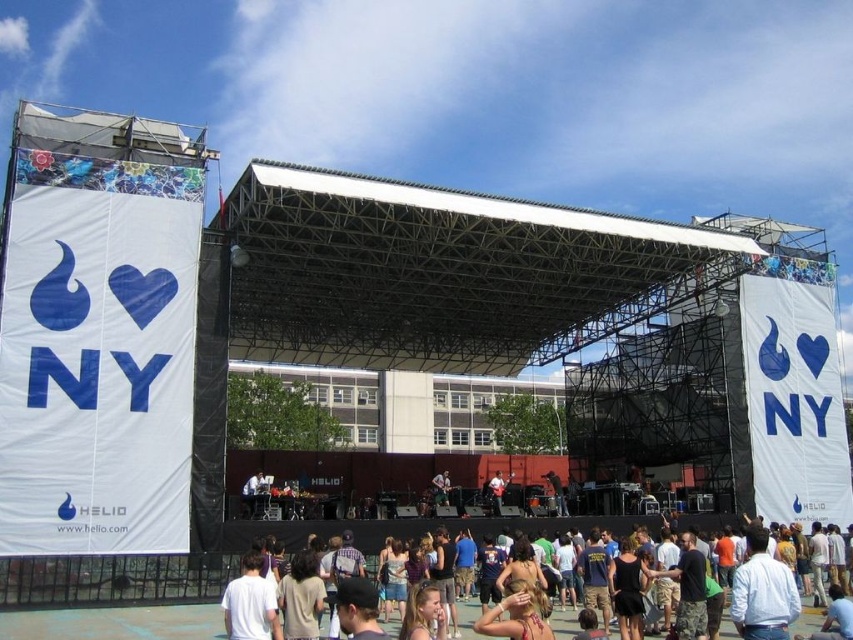
Locate an element on the screen. white cotton shirt at lower center is located at coordinates (397, 529).

Does white cotton shirt at lower center have a smaller size compared to shiny black guitar at center?

No.

You are a GUI agent. You are given a task and a screenshot of the screen. Output one action in this format:
    pyautogui.click(x=<x>, y=<y>)
    Task: Click on the white cotton shirt at lower center
    Image resolution: width=853 pixels, height=640 pixels.
    Given the screenshot: What is the action you would take?
    pyautogui.click(x=397, y=529)

This screenshot has height=640, width=853. In order to click on white cotton shirt at lower center in this screenshot , I will do `click(397, 529)`.

Is white cotton shirt at lower center closer to the viewer compared to white cotton t-shirt at lower center?

No, white cotton shirt at lower center is behind white cotton t-shirt at lower center.

Who is more distant from viewer, (625, 518) or (259, 637)?

The point (625, 518) is more distant.

Where is `white cotton shirt at lower center`? This screenshot has height=640, width=853. white cotton shirt at lower center is located at coordinates (397, 529).

Is point (612, 516) farther from viewer compared to point (498, 508)?

No, (612, 516) is in front of (498, 508).

What do you see at coordinates (397, 529) in the screenshot?
I see `white cotton shirt at lower center` at bounding box center [397, 529].

Who is more distant from viewer, (703, 520) or (489, 484)?

The point (489, 484) is behind.

In order to click on white cotton shirt at lower center in this screenshot , I will do `click(397, 529)`.